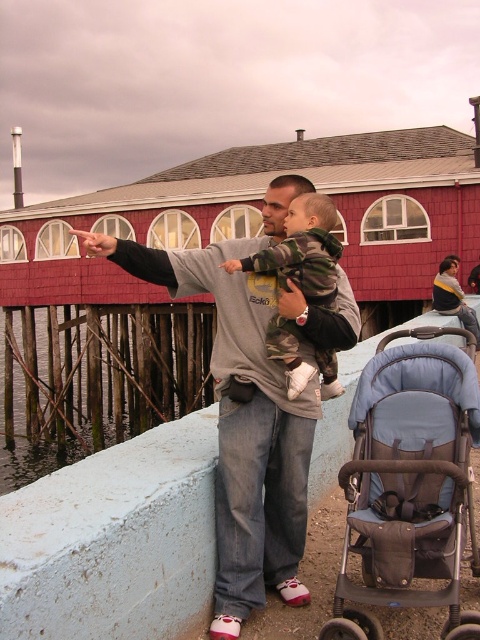
You are a photographer planning to take a photo of the blue fabric stroller at lower right and the clear water at lower left. The camera you are using has a maximum focus range of 20 meters. Will you be able to capture both subjects in focus without moving your position?

The blue fabric stroller at lower right and clear water at lower left are 22.90 meters apart. Since the camera can only focus up to 20 meters, the distance between them exceeds the focus range. Therefore, you cannot capture both in focus without moving closer.